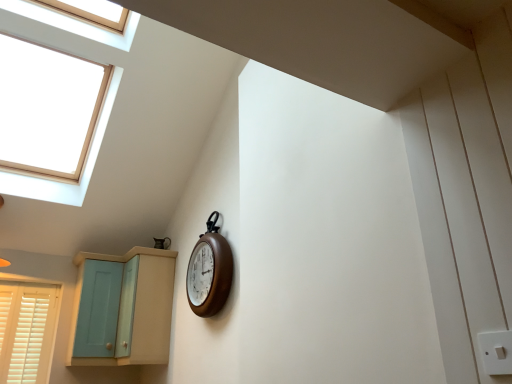
Question: Does light blue wood cabinet at lower left have a larger size compared to light teal wood cabinet at lower left?

Choices:
 (A) no
 (B) yes

Answer: (A)

Question: Does light blue wood cabinet at lower left have a greater height compared to light teal wood cabinet at lower left?

Choices:
 (A) no
 (B) yes

Answer: (A)

Question: From the image's perspective, is light blue wood cabinet at lower left on top of light teal wood cabinet at lower left?

Choices:
 (A) yes
 (B) no

Answer: (B)

Question: Is light blue wood cabinet at lower left wider than light teal wood cabinet at lower left?

Choices:
 (A) no
 (B) yes

Answer: (A)

Question: Is light blue wood cabinet at lower left further to camera compared to light teal wood cabinet at lower left?

Choices:
 (A) yes
 (B) no

Answer: (A)

Question: From the image's perspective, is light blue wood cabinet at lower left under light teal wood cabinet at lower left?

Choices:
 (A) yes
 (B) no

Answer: (A)

Question: Can you confirm if wooden clock at center is wider than light teal wood cabinet at lower left?

Choices:
 (A) yes
 (B) no

Answer: (B)

Question: Can you see wooden clock at center touching light teal wood cabinet at lower left?

Choices:
 (A) yes
 (B) no

Answer: (B)

Question: Considering the relative sizes of wooden clock at center and light teal wood cabinet at lower left in the image provided, is wooden clock at center shorter than light teal wood cabinet at lower left?

Choices:
 (A) no
 (B) yes

Answer: (B)

Question: From the image's perspective, is wooden clock at center on top of light teal wood cabinet at lower left?

Choices:
 (A) no
 (B) yes

Answer: (B)

Question: Is light teal wood cabinet at lower left surrounded by wooden clock at center?

Choices:
 (A) no
 (B) yes

Answer: (A)

Question: Is there a large distance between wooden clock at center and light teal wood cabinet at lower left?

Choices:
 (A) yes
 (B) no

Answer: (B)

Question: Considering the relative sizes of white plastic switch at lower right and light blue wood cabinet at lower left in the image provided, is white plastic switch at lower right bigger than light blue wood cabinet at lower left?

Choices:
 (A) no
 (B) yes

Answer: (A)